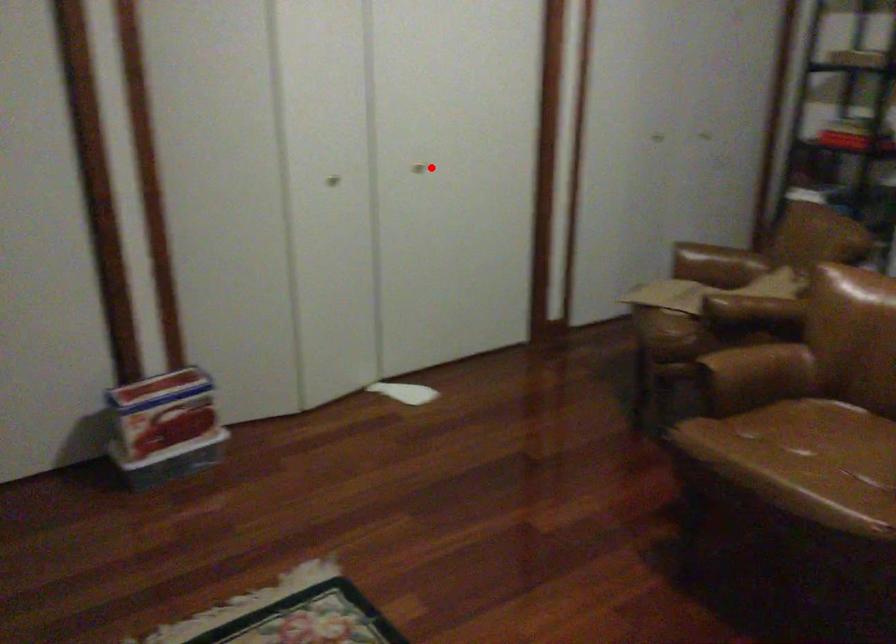
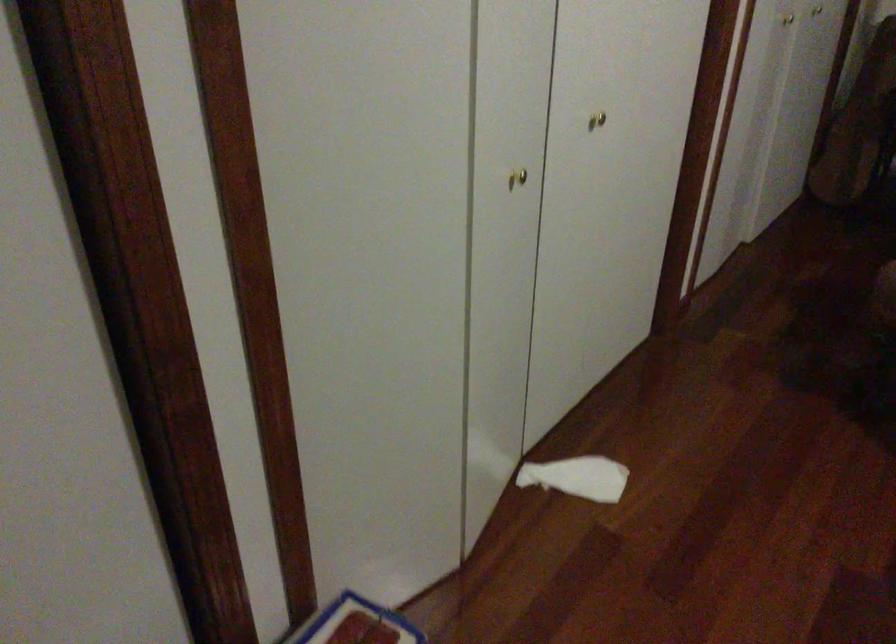
Question: I am providing you with two images of the same scene from different viewpoints. In image1, a red point is highlighted. Considering the same 3D point in image2, which of the following is correct?

Choices:
 (A) It is closer
 (B) It is farther

Answer: (A)